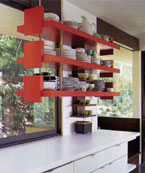
You are a GUI agent. You are given a task and a screenshot of the screen. Output one action in this format:
    pyautogui.click(x=<x>, y=<y>)
    Task: Click on the green cup
    The image size is (145, 173).
    Given the screenshot: What is the action you would take?
    pyautogui.click(x=90, y=52), pyautogui.click(x=95, y=53)